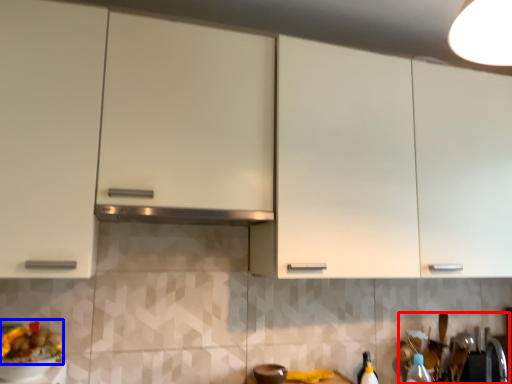
Question: Which object is further to the camera taking this photo, sink (highlighted by a red box) or food (highlighted by a blue box)?

Choices:
 (A) sink
 (B) food

Answer: (A)